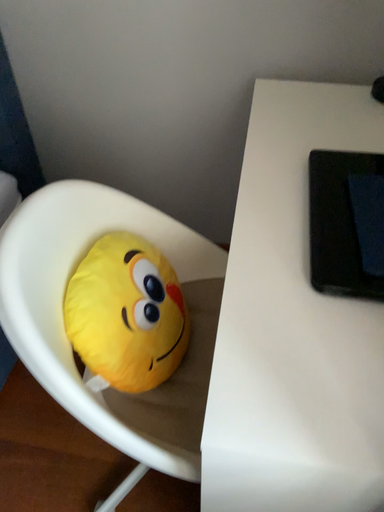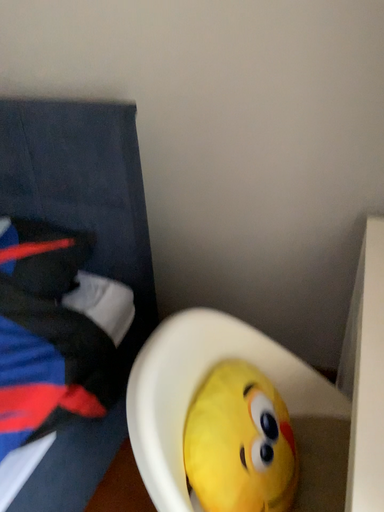
Question: Which way did the camera rotate in the video?

Choices:
 (A) rotated right
 (B) rotated left

Answer: (B)